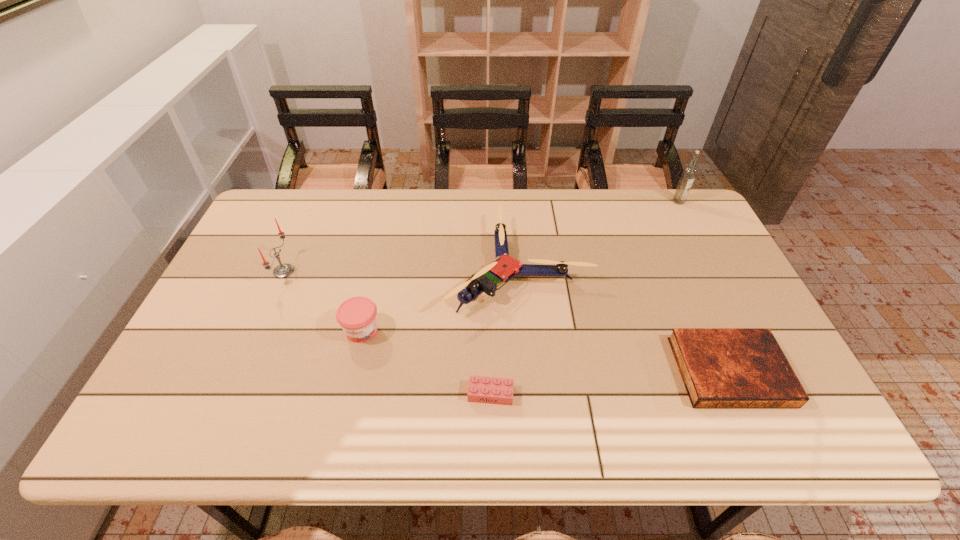
The height and width of the screenshot is (540, 960). Find the location of `the tallest object`. the tallest object is located at coordinates (688, 175).

Where is `vodka`? vodka is located at coordinates (688, 175).

Image resolution: width=960 pixels, height=540 pixels. I want to click on the leftmost object, so click(284, 270).

I want to click on candle, so click(x=284, y=270).

You are a GUI agent. You are given a task and a screenshot of the screen. Output one action in this format:
    pyautogui.click(x=<x>, y=<y>)
    Task: Click on the drone
    
    Given the screenshot: What is the action you would take?
    pyautogui.click(x=504, y=267)

Find the location of a particular element. The height and width of the screenshot is (540, 960). jam is located at coordinates (357, 316).

Find the location of a particular element. The image size is (960, 540). Bible is located at coordinates (720, 367).

Find the location of `Lego`. Lego is located at coordinates coord(481,389).

Identify the location of vacant space located 0.280m on the label of the farthest object. The width and height of the screenshot is (960, 540). (709, 261).

Find the location of a particular element. The width and height of the screenshot is (960, 540). vacant space located 0.200m on the front-facing side of the candle is located at coordinates (361, 271).